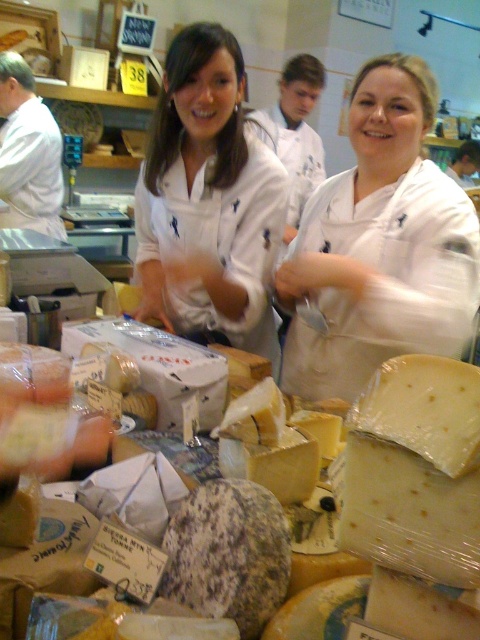
Question: Can you confirm if white matte apron at center is wider than white matte uniform at center?

Choices:
 (A) yes
 (B) no

Answer: (B)

Question: Which of the following is the farthest from the observer?

Choices:
 (A) (257, 316)
 (B) (382, 225)

Answer: (A)

Question: Is white matte apron at center to the left of white matte uniform at center from the viewer's perspective?

Choices:
 (A) no
 (B) yes

Answer: (A)

Question: Is the position of white matte apron at center more distant than that of white matte uniform at center?

Choices:
 (A) yes
 (B) no

Answer: (B)